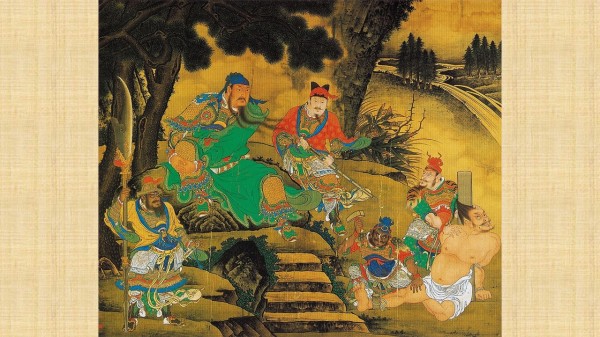
You are a GUI agent. You are given a task and a screenshot of the screen. Output one action in this format:
    pyautogui.click(x=<x>, y=<y>)
    Task: Click on the sheet
    
    Given the screenshot: What is the action you would take?
    pyautogui.click(x=462, y=295)